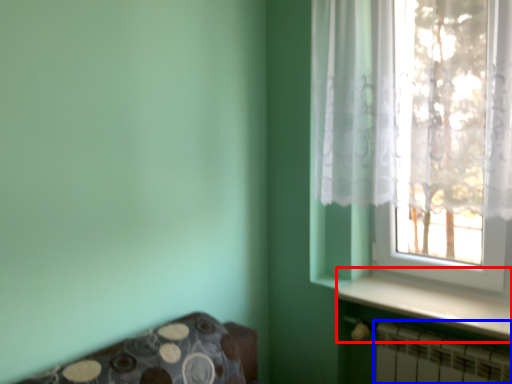
Question: Which point is further to the camera, window sill (highlighted by a red box) or radiator (highlighted by a blue box)?

Choices:
 (A) window sill
 (B) radiator

Answer: (A)